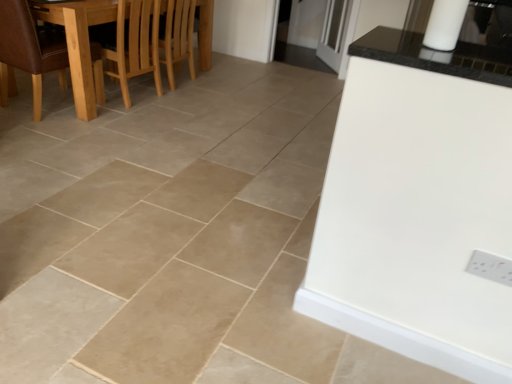
Locate an element on the screen. Image resolution: width=512 pixels, height=384 pixels. vacant area that is in front of light brown wooden chair at upper left is located at coordinates (160, 98).